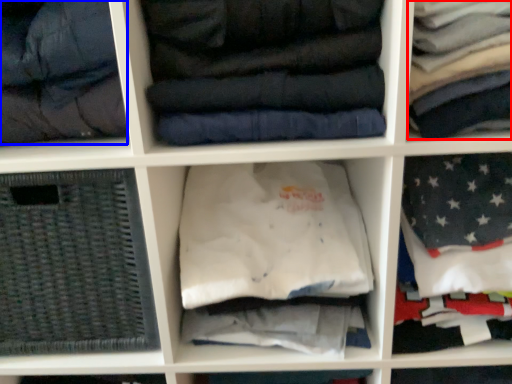
Question: Which object appears closest to the camera in this image, clothing (highlighted by a red box) or garment (highlighted by a blue box)?

Choices:
 (A) clothing
 (B) garment

Answer: (A)